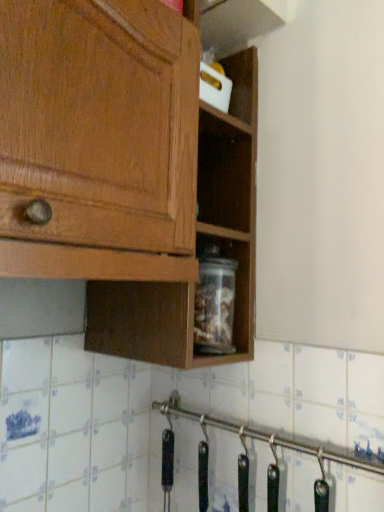
Question: Should I look upward or downward to see black rubber hooks at lower right?

Choices:
 (A) down
 (B) up

Answer: (A)